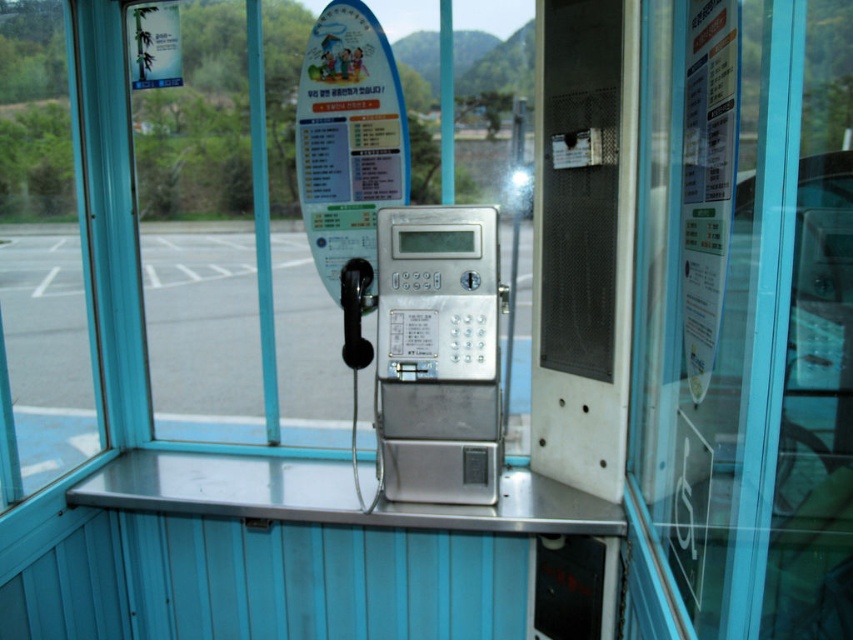
Question: Which object appears closest to the camera in this image?

Choices:
 (A) sleek silver phone at center
 (B) gray asphalt parking lot at center

Answer: (A)

Question: Is the position of gray asphalt parking lot at center more distant than that of sleek silver phone at center?

Choices:
 (A) no
 (B) yes

Answer: (B)

Question: Is gray asphalt parking lot at center bigger than sleek silver phone at center?

Choices:
 (A) yes
 (B) no

Answer: (A)

Question: Which point is farther to the camera?

Choices:
 (A) (317, 307)
 (B) (393, 250)

Answer: (A)

Question: Can you confirm if gray asphalt parking lot at center is wider than sleek silver phone at center?

Choices:
 (A) yes
 (B) no

Answer: (A)

Question: Which point is farther to the camera?

Choices:
 (A) (390, 291)
 (B) (59, 340)

Answer: (B)